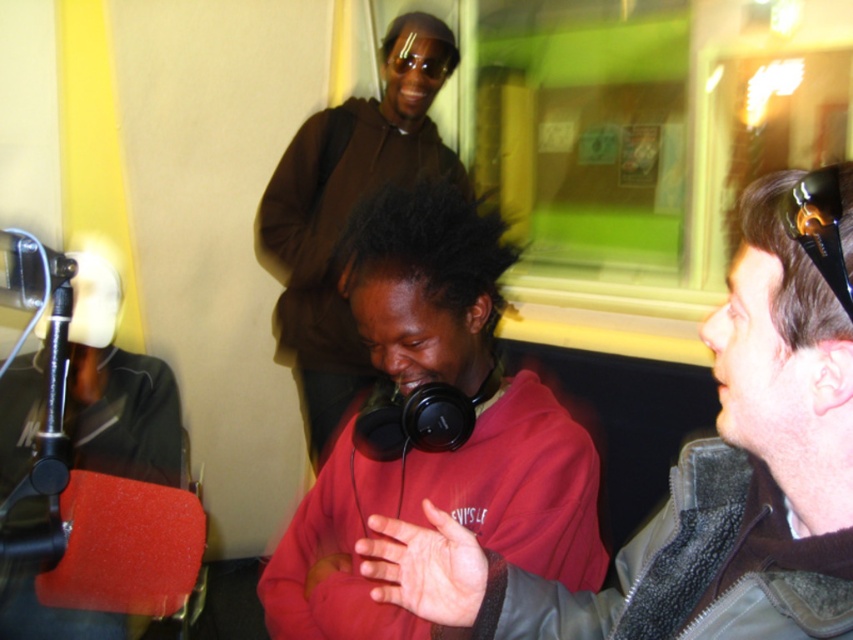
Question: Is matte red hoodie at center positioned behind black plastic microphone at upper right?

Choices:
 (A) no
 (B) yes

Answer: (B)

Question: Which object is the farthest from the black plastic microphone at upper right?

Choices:
 (A) rubberized black microphone at left
 (B) matte black headphones at center
 (C) matte red hoodie at center
 (D) brown matte jacket at upper center

Answer: (A)

Question: Which object appears farthest from the camera in this image?

Choices:
 (A) brown matte jacket at upper center
 (B) rubberized black microphone at left
 (C) matte red hoodie at center

Answer: (A)

Question: Considering the relative positions of brown matte jacket at upper center and rubberized black microphone at left in the image provided, where is brown matte jacket at upper center located with respect to rubberized black microphone at left?

Choices:
 (A) left
 (B) right

Answer: (B)

Question: Does brown matte jacket at upper center have a smaller size compared to rubberized black microphone at left?

Choices:
 (A) yes
 (B) no

Answer: (B)

Question: Which of the following is the closest to the observer?

Choices:
 (A) matte red hoodie at center
 (B) rubberized black microphone at left
 (C) matte black headphones at center

Answer: (C)